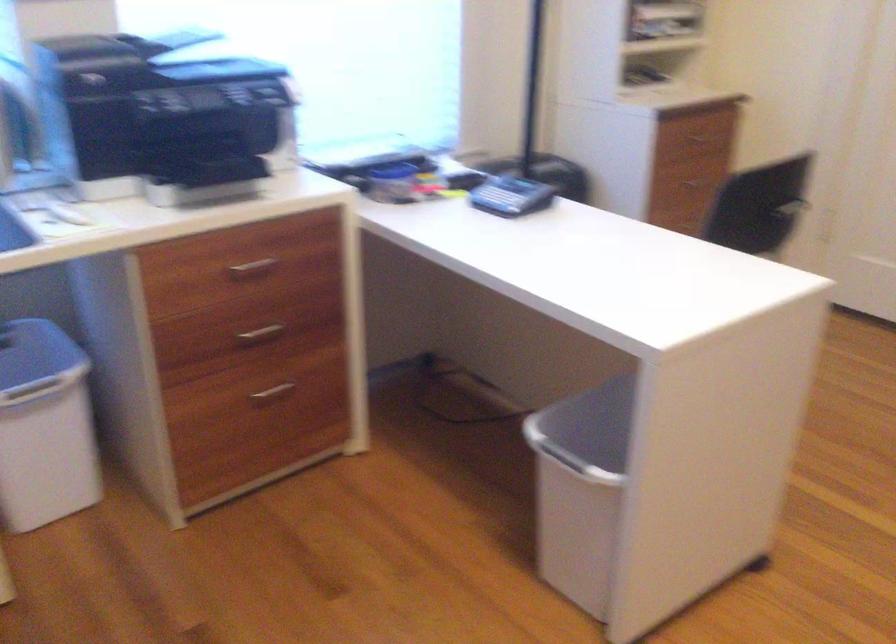
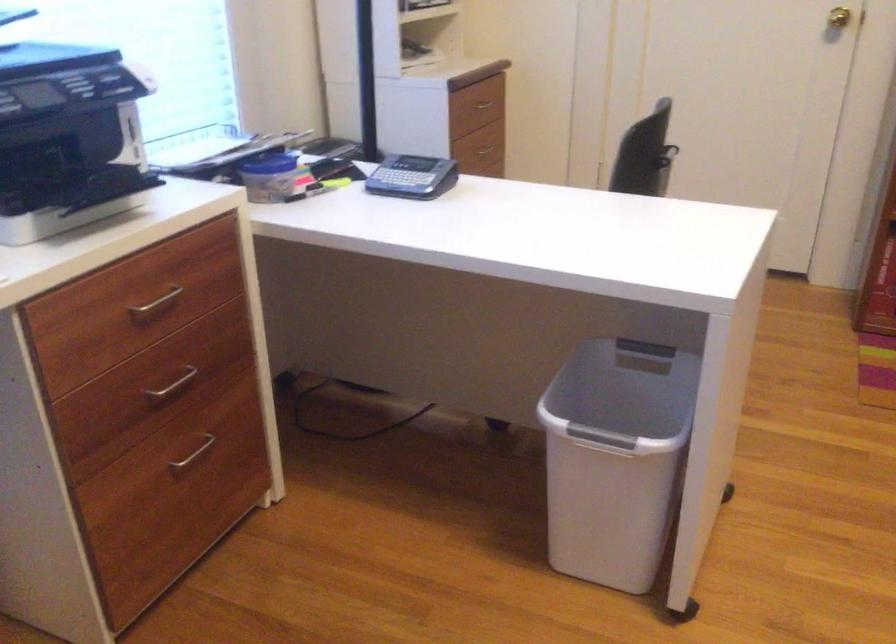
Locate, in the second image, the point that corresponds to point (691, 185) in the first image.

(486, 149)